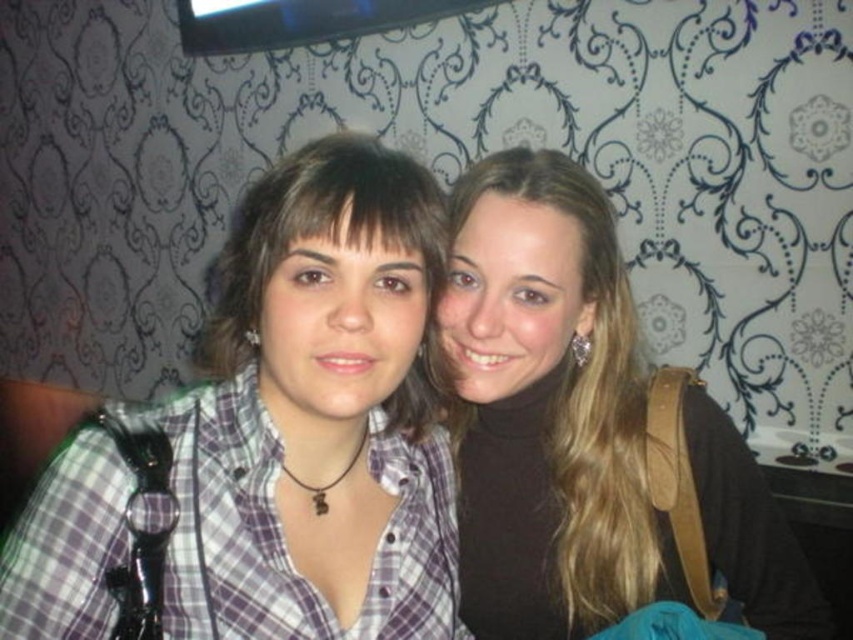
You are taking a photo of two people standing in front of you. You notice two specific points in the image labeled as point [363,624] and point [505,225]. Which of these points is nearer to your camera?

Point [363,624] is closer to the camera than point [505,225].

You are standing in a room with two people. You see the plaid shirt at center and the smooth brown hair at center. Which object is closer to you?

The plaid shirt at center is closer to you because it is in front of the smooth brown hair at center.